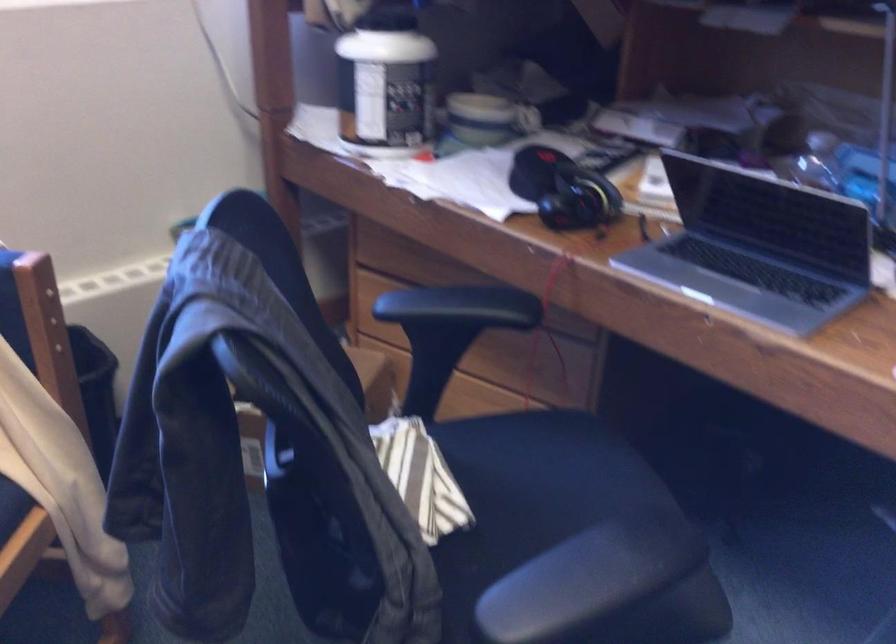
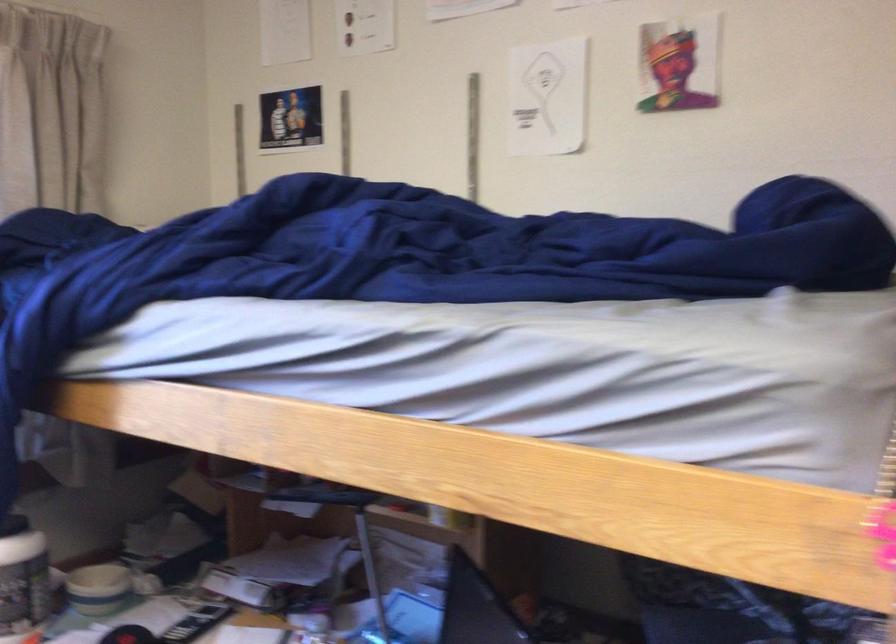
Where in the second image is the point corresponding to (474,111) from the first image?

(98, 589)